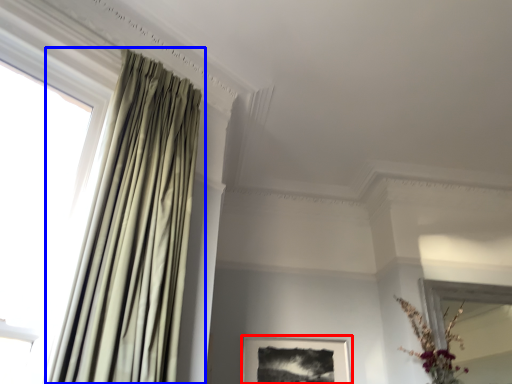
Question: Which point is closer to the camera, picture frame (highlighted by a red box) or curtain (highlighted by a blue box)?

Choices:
 (A) picture frame
 (B) curtain

Answer: (B)